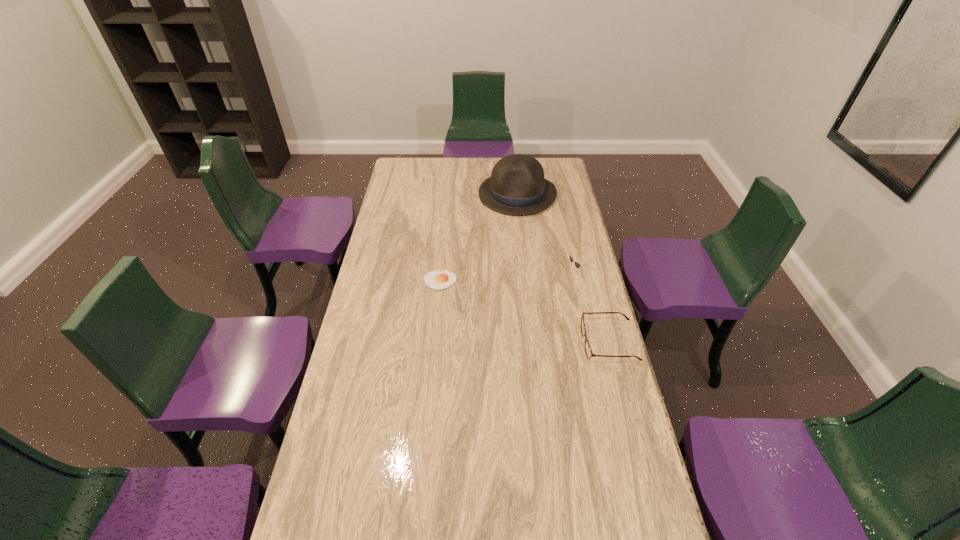
Where is `bowler hat present at the right edge`? bowler hat present at the right edge is located at coordinates (517, 186).

What are the coordinates of `object that is positioned at the far right corner` in the screenshot? It's located at (517, 186).

Locate an element on the screen. vacant space at the far edge of the desktop is located at coordinates (440, 173).

In the image, there is a desktop. Where is `vacant space at the near edge`? This screenshot has height=540, width=960. vacant space at the near edge is located at coordinates (488, 537).

Locate an element on the screen. Image resolution: width=960 pixels, height=540 pixels. free spot at the left edge of the desktop is located at coordinates (382, 413).

In the image, there is a desktop. Where is `free region at the right edge`? free region at the right edge is located at coordinates (566, 211).

At what (x,y) coordinates should I click in order to perform the action: click on free location at the far left corner of the desktop. Please return your answer as a coordinate pair (x, y). Looking at the image, I should click on (414, 177).

The height and width of the screenshot is (540, 960). In the image, there is a desktop. What are the coordinates of `free region at the far right corner` in the screenshot? It's located at (566, 178).

In the image, there is a desktop. Where is `vacant space at the near right corner`? This screenshot has width=960, height=540. vacant space at the near right corner is located at coordinates (655, 507).

This screenshot has width=960, height=540. I want to click on free space between the third shortest object and the tallest object, so click(547, 234).